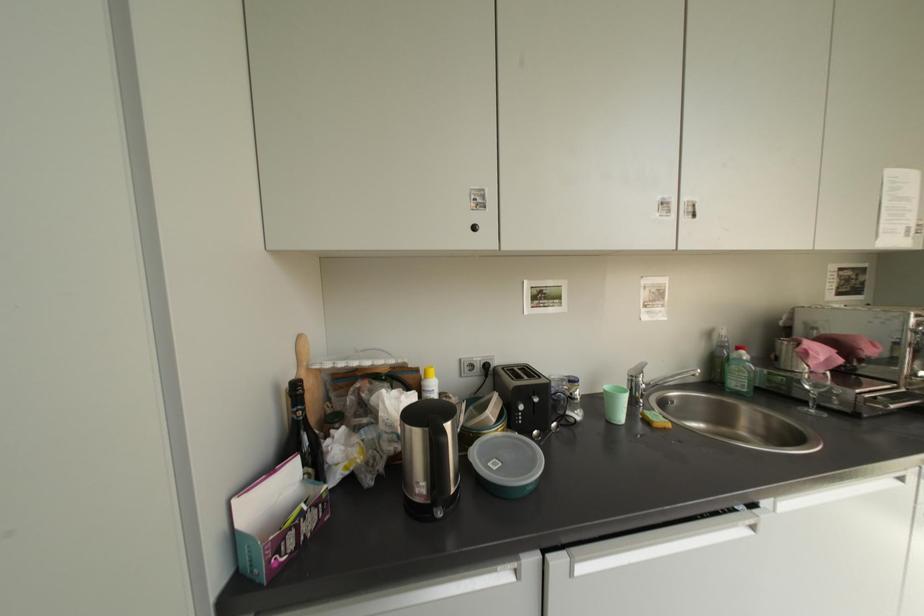
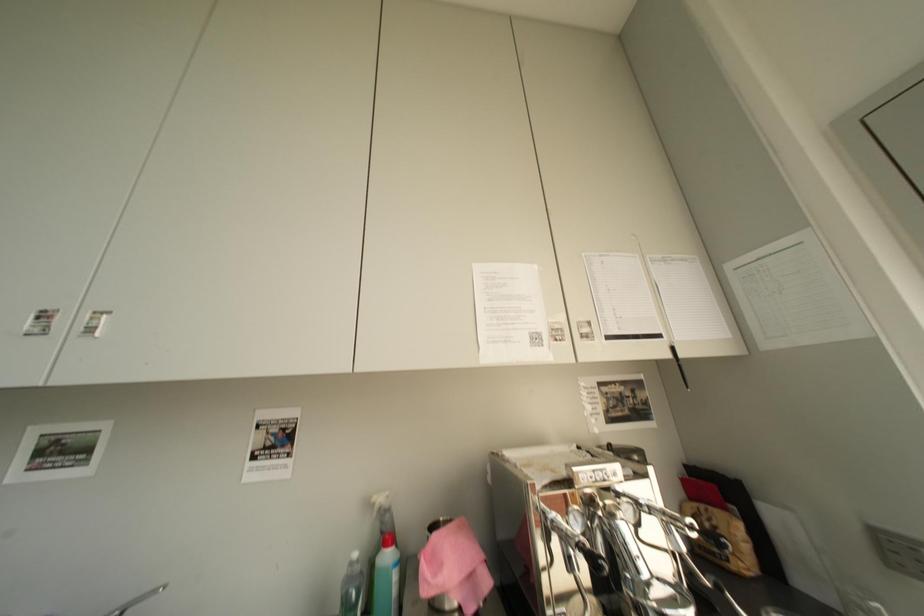
Question: Which direction would the cameraman need to move to produce the second image? Reply with the corresponding letter.

Choices:
 (A) Left
 (B) Right
 (C) Forward
 (D) Backward

Answer: (B)